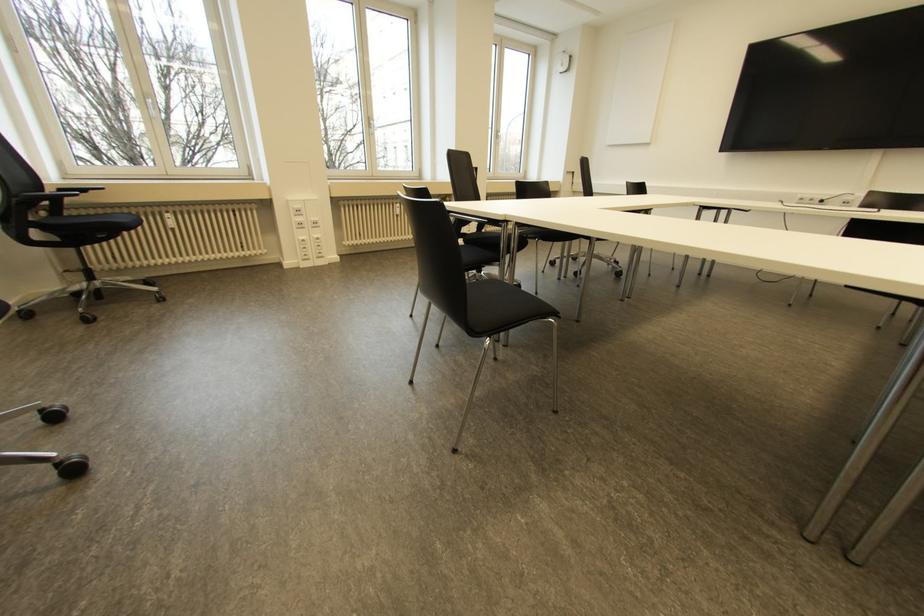
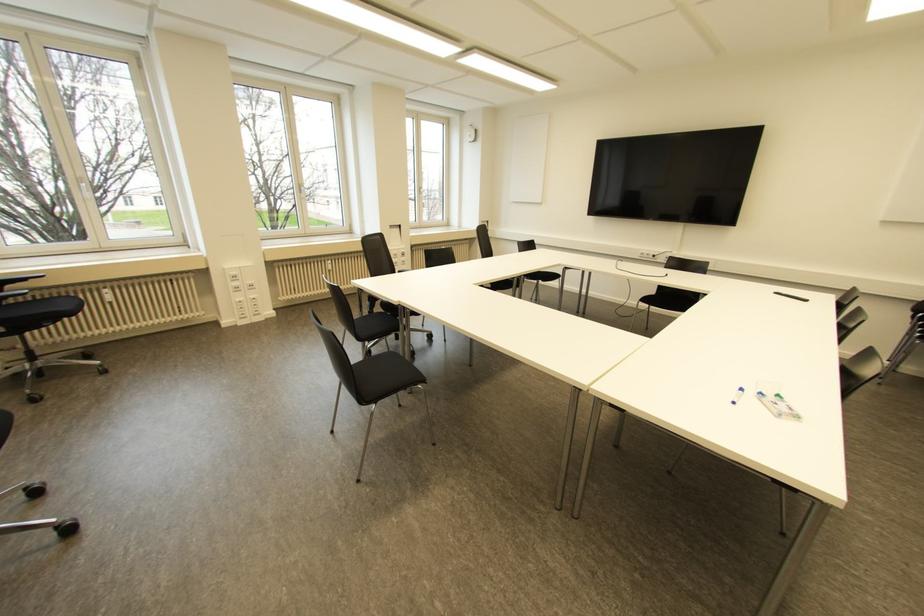
Where in the second image is the point corresponding to the point at 295,206 from the first image?

(232, 273)